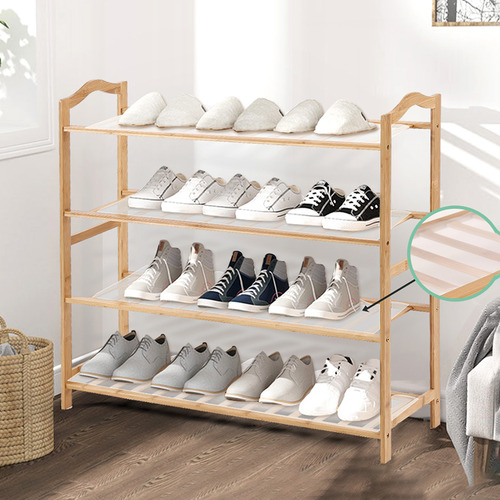
The height and width of the screenshot is (500, 500). Find the location of `shoes on shelf above bottom shelf`. shoes on shelf above bottom shelf is located at coordinates (154, 274), (190, 276), (223, 282), (257, 282), (298, 288), (331, 291).